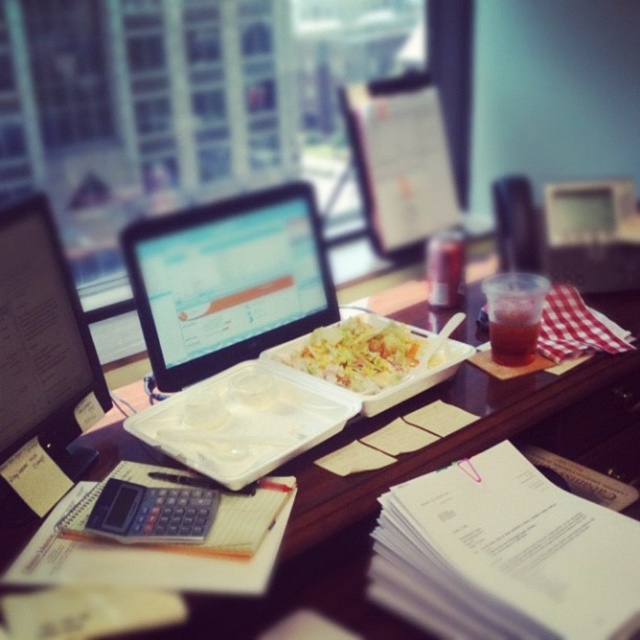
Question: Which object appears farthest from the camera in this image?

Choices:
 (A) white plastic tray at center
 (B) black plastic calculator at lower left
 (C) matte black monitor at left
 (D) translucent plastic cup at center right

Answer: (D)

Question: Considering the real-world distances, which object is farthest from the black plastic calculator at lower left?

Choices:
 (A) wooden table at center
 (B) translucent plastic cup at center right
 (C) matte black monitor at left

Answer: (B)

Question: Can you confirm if matte black monitor at left is positioned below white plastic tray at center?

Choices:
 (A) yes
 (B) no

Answer: (B)

Question: Which point appears farthest from the camera in this image?

Choices:
 (A) (371, 316)
 (B) (36, 304)

Answer: (A)

Question: Can you confirm if wooden table at center is positioned to the left of translucent plastic cup at center right?

Choices:
 (A) yes
 (B) no

Answer: (A)

Question: Is wooden table at center to the left of matte black monitor at left from the viewer's perspective?

Choices:
 (A) yes
 (B) no

Answer: (B)